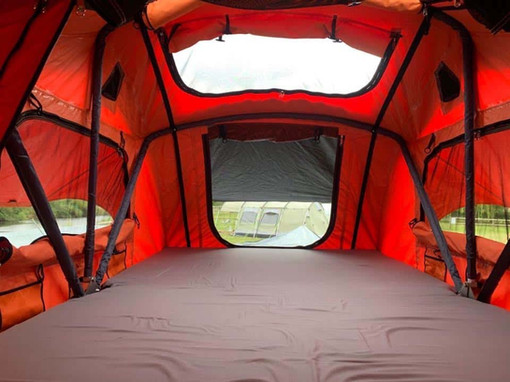
Where is `skylight`? skylight is located at coordinates (286, 63).